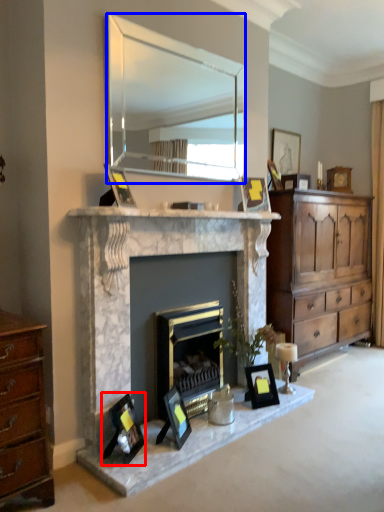
Question: Which point is further to the camera, picture frame (highlighted by a red box) or mirror (highlighted by a blue box)?

Choices:
 (A) picture frame
 (B) mirror

Answer: (B)